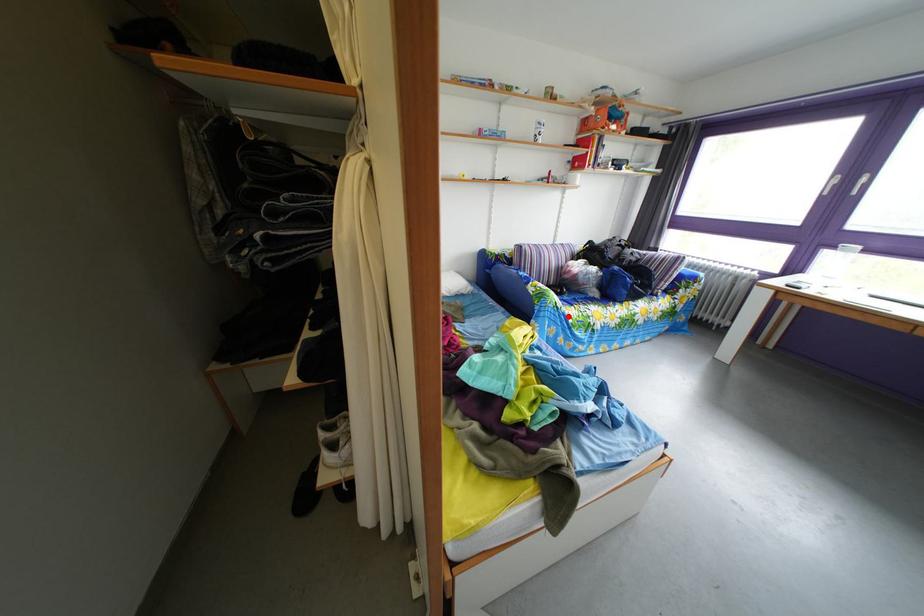
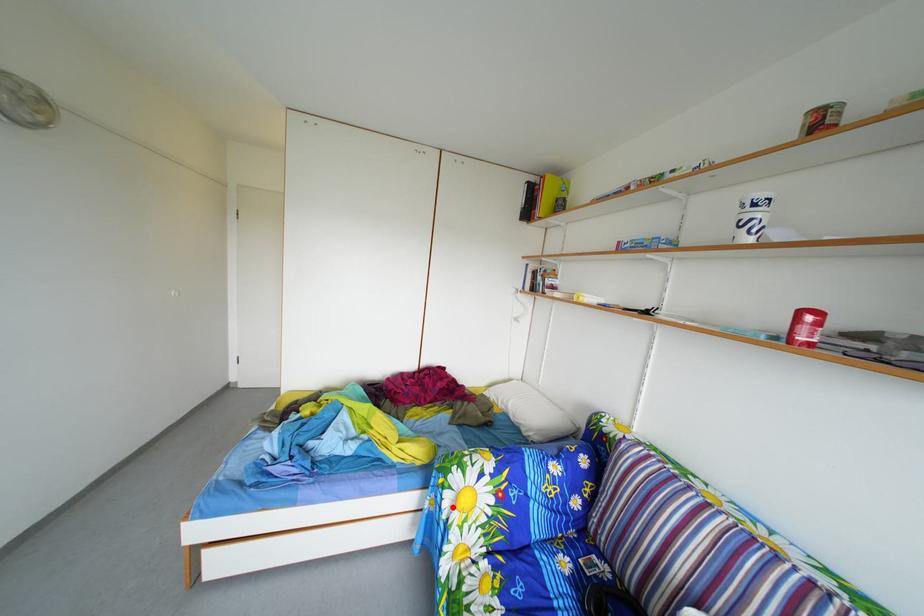
I am providing you with two images of the same scene from different viewpoints. A red point is marked on the first image and another point is marked on the second image. Does the point marked in image1 correspond to the same location as the one in image2?

Yes